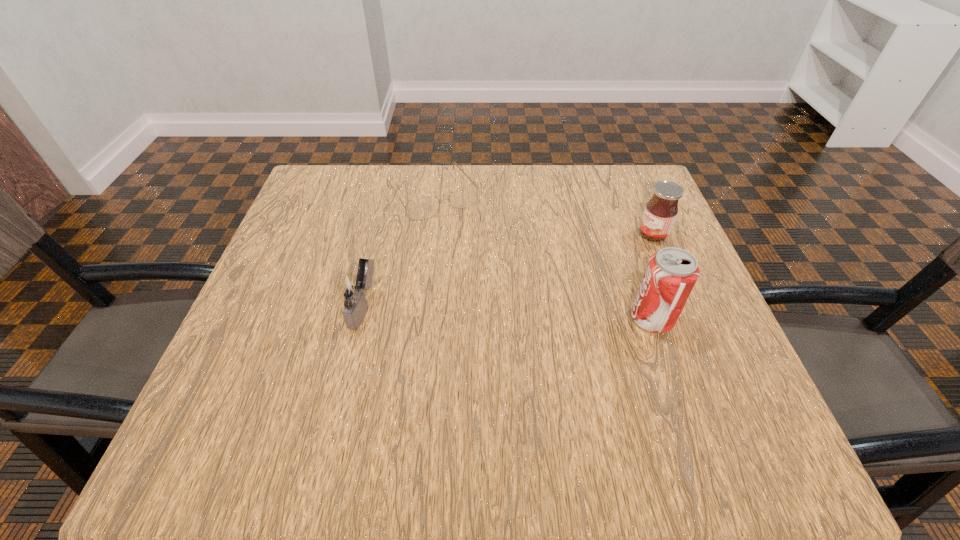
Where is `igniter`? The height and width of the screenshot is (540, 960). igniter is located at coordinates (351, 288).

In order to click on the tallest object in this screenshot , I will do `click(671, 274)`.

The width and height of the screenshot is (960, 540). What are the coordinates of `the shortest object` in the screenshot? It's located at (424, 207).

Identify the location of the farthest object. The image size is (960, 540). (424, 207).

Where is `the third nearest object`? the third nearest object is located at coordinates pos(660,213).

The image size is (960, 540). Find the location of `free space located on the right of the igniter`. free space located on the right of the igniter is located at coordinates (470, 307).

This screenshot has height=540, width=960. In order to click on vacant region located on the back of the soda can in this screenshot , I will do `click(627, 246)`.

Where is `free location located 0.120m on the front-facing side of the farthest object`? Image resolution: width=960 pixels, height=540 pixels. free location located 0.120m on the front-facing side of the farthest object is located at coordinates (470, 248).

At what (x,y) coordinates should I click in order to perform the action: click on vacant area situated 0.130m on the front-facing side of the farthest object. Please return your answer as a coordinate pair (x, y). Image resolution: width=960 pixels, height=540 pixels. Looking at the image, I should click on click(472, 251).

The height and width of the screenshot is (540, 960). Identify the location of vacant space located 0.300m on the front-facing side of the farthest object. (508, 303).